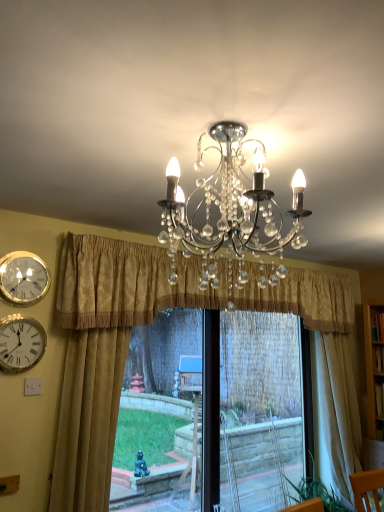
Question: Is gold textured curtain at center, which ranks as the 2th curtain in right-to-left order, positioned with its back to white glossy wall clock at left, which is counted as the 2th wall clock, starting from the top?

Choices:
 (A) no
 (B) yes

Answer: (A)

Question: From the image's perspective, is gold textured curtain at center, which ranks as the 2th curtain in right-to-left order, located beneath white glossy wall clock at left, the first wall clock positioned from the bottom?

Choices:
 (A) no
 (B) yes

Answer: (A)

Question: Considering the relative sizes of gold textured curtain at center, which ranks as the 2th curtain in right-to-left order, and white glossy wall clock at left, the first wall clock positioned from the bottom, in the image provided, is gold textured curtain at center, which ranks as the 2th curtain in right-to-left order, thinner than white glossy wall clock at left, the first wall clock positioned from the bottom,?

Choices:
 (A) yes
 (B) no

Answer: (B)

Question: Does gold textured curtain at center, which ranks as the 2th curtain in right-to-left order, turn towards white glossy wall clock at left, the first wall clock positioned from the bottom?

Choices:
 (A) yes
 (B) no

Answer: (B)

Question: Is gold textured curtain at center, which is the 2th curtain from left to right, located outside white glossy wall clock at left, which is counted as the 2th wall clock, starting from the top?

Choices:
 (A) no
 (B) yes

Answer: (B)

Question: Considering their positions, is black plastic window frame at center located in front of or behind beige fabric curtain at right, the first curtain when ordered from right to left?

Choices:
 (A) behind
 (B) front

Answer: (B)

Question: Is black plastic window frame at center taller or shorter than beige fabric curtain at right, positioned as the third curtain in left-to-right order?

Choices:
 (A) short
 (B) tall

Answer: (A)

Question: From the image's perspective, relative to beige fabric curtain at right, the first curtain when ordered from right to left, is black plastic window frame at center above or below?

Choices:
 (A) below
 (B) above

Answer: (A)

Question: Based on their sizes in the image, would you say black plastic window frame at center is bigger or smaller than beige fabric curtain at right, positioned as the third curtain in left-to-right order?

Choices:
 (A) big
 (B) small

Answer: (A)

Question: From the image's perspective, is gold textured curtain at left, the third curtain when ordered from right to left, above or below gold metallic wall clock at upper left, which is counted as the first wall clock, starting from the top?

Choices:
 (A) above
 (B) below

Answer: (B)

Question: Is gold textured curtain at left, the 1th curtain when ordered from left to right, wider or thinner than gold metallic wall clock at upper left, the 2th wall clock when ordered from bottom to top?

Choices:
 (A) wide
 (B) thin

Answer: (A)

Question: Which is correct: gold textured curtain at left, the 1th curtain when ordered from left to right, is inside gold metallic wall clock at upper left, the 2th wall clock when ordered from bottom to top, or outside of it?

Choices:
 (A) inside
 (B) outside

Answer: (B)

Question: Considering the positions of gold textured curtain at left, the 1th curtain when ordered from left to right, and gold metallic wall clock at upper left, the 2th wall clock when ordered from bottom to top, in the image, is gold textured curtain at left, the 1th curtain when ordered from left to right, taller or shorter than gold metallic wall clock at upper left, the 2th wall clock when ordered from bottom to top,?

Choices:
 (A) tall
 (B) short

Answer: (A)

Question: In terms of size, does gold textured curtain at center, which ranks as the 2th curtain in right-to-left order, appear bigger or smaller than beige fabric curtain at right, the first curtain when ordered from right to left?

Choices:
 (A) small
 (B) big

Answer: (B)

Question: Choose the correct answer: Is gold textured curtain at center, which ranks as the 2th curtain in right-to-left order, inside beige fabric curtain at right, positioned as the third curtain in left-to-right order, or outside it?

Choices:
 (A) outside
 (B) inside

Answer: (A)